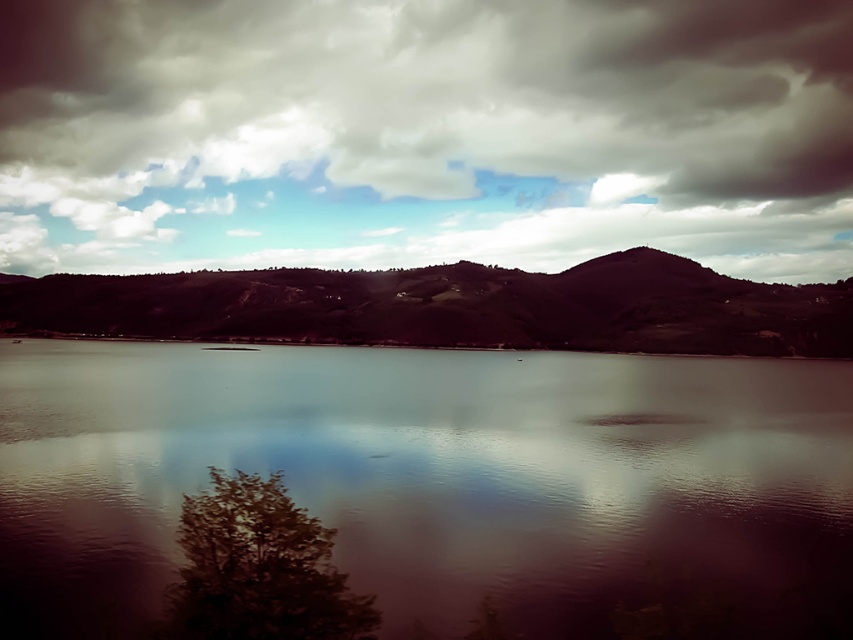
Question: Does smooth water at center appear over dark brown textured hill at center?

Choices:
 (A) yes
 (B) no

Answer: (B)

Question: Is smooth water at center below dark brown textured hill at center?

Choices:
 (A) no
 (B) yes

Answer: (B)

Question: Which point is farther to the camera?

Choices:
 (A) cloudy sky at upper center
 (B) smooth water at center

Answer: (A)

Question: Which point is farther from the camera taking this photo?

Choices:
 (A) (256, 285)
 (B) (511, 52)
 (C) (169, 445)

Answer: (B)

Question: Among these objects, which one is farthest from the camera?

Choices:
 (A) cloudy sky at upper center
 (B) smooth water at center

Answer: (A)

Question: Does cloudy sky at upper center appear under dark brown textured hill at center?

Choices:
 (A) no
 (B) yes

Answer: (A)